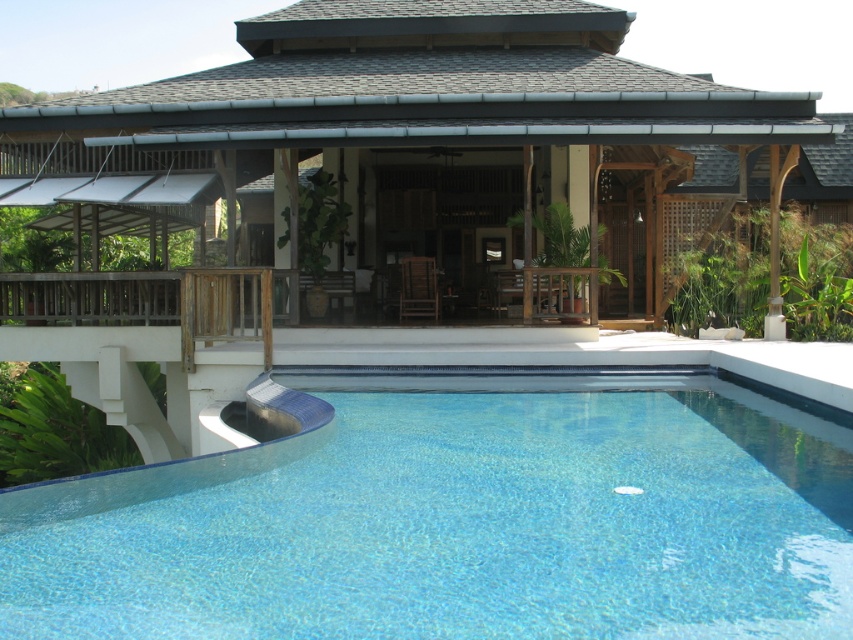
You are planning to host a pool party and need to choose between the blue tile pool at lower center and the clear glass pool at center. Which pool has a bigger capacity for guests?

The blue tile pool at lower center is larger in size than the clear glass pool at center, so it has a bigger capacity for guests.

You are standing in the outdoor area looking at the swimming pool and the two points marked in the image. Which point, point (430, 234) or point (531, 628), is closer to you?

Point (430, 234) is further to the camera than point (531, 628), so the closer point to you is point (531, 628).